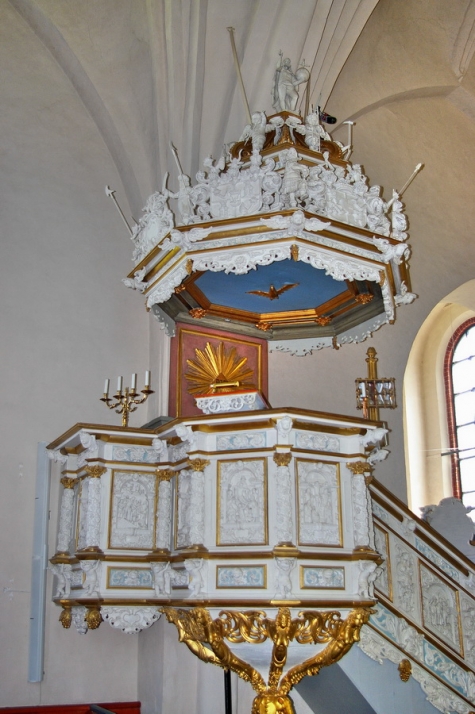
The image size is (475, 714). I want to click on candle, so pos(105,383), pos(119,387), pos(134,383), pos(146,377).